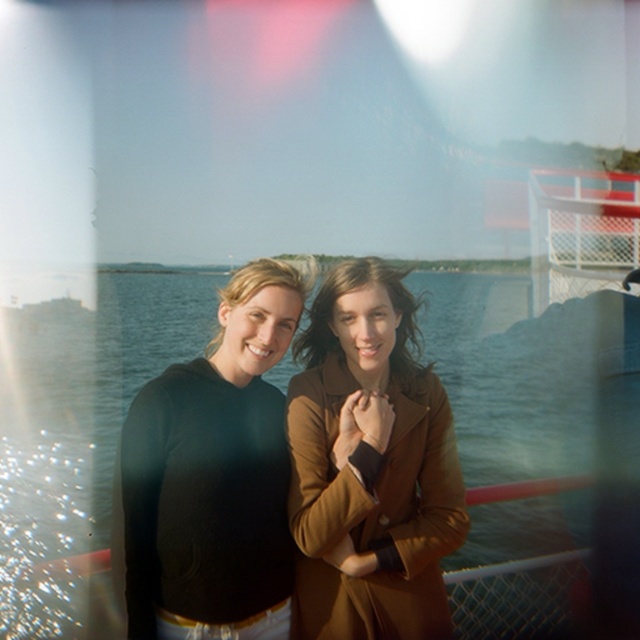
Question: Can you confirm if clear water at center is positioned to the right of matte brown coat at center?

Choices:
 (A) no
 (B) yes

Answer: (A)

Question: In this image, where is clear water at center located relative to matte brown coat at center?

Choices:
 (A) above
 (B) below

Answer: (A)

Question: Which object appears farthest from the camera in this image?

Choices:
 (A) brown leather jacket at center
 (B) matte brown coat at center
 (C) clear water at center
 (D) black matte sweater at center

Answer: (B)

Question: Which of the following is the closest to the observer?

Choices:
 (A) black matte sweater at center
 (B) matte brown coat at center

Answer: (A)

Question: Which object is positioned farthest from the clear water at center?

Choices:
 (A) brown leather jacket at center
 (B) black matte sweater at center

Answer: (B)

Question: Can you confirm if clear water at center is bigger than black matte sweater at center?

Choices:
 (A) no
 (B) yes

Answer: (B)